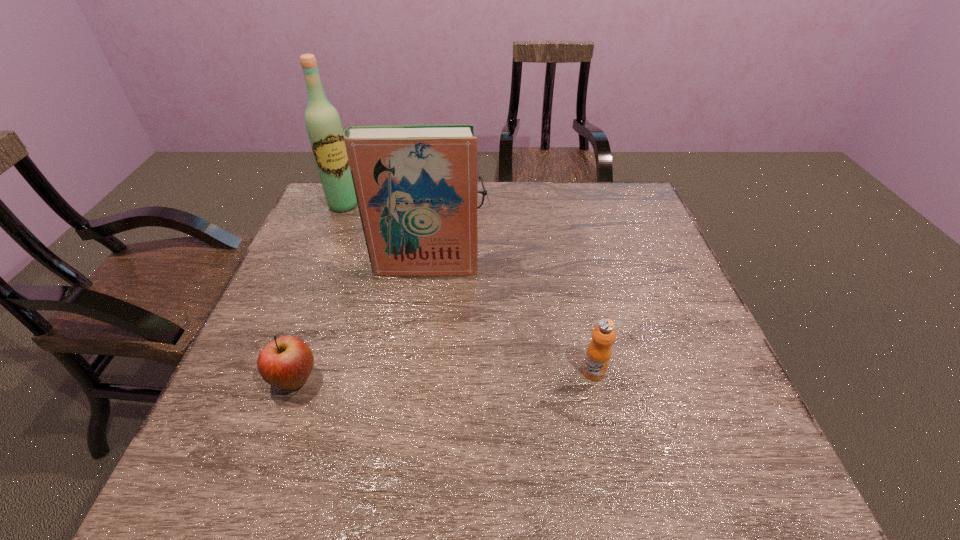
I want to click on object that is at the near edge, so click(285, 363).

Locate an element on the screen. apple at the left edge is located at coordinates (285, 363).

Identify the location of wine bottle situated at the left edge. (323, 124).

The height and width of the screenshot is (540, 960). I want to click on object at the far left corner, so click(323, 124).

This screenshot has width=960, height=540. What are the coordinates of `object present at the near left corner` in the screenshot? It's located at (285, 363).

At what (x,y) coordinates should I click in order to perform the action: click on free location at the far edge of the desktop. Please return your answer as a coordinate pair (x, y). This screenshot has width=960, height=540. Looking at the image, I should click on (553, 208).

At what (x,y) coordinates should I click in order to perform the action: click on blank space at the near edge of the desktop. Please return your answer as a coordinate pair (x, y). Looking at the image, I should click on (625, 413).

I want to click on vacant space at the left edge, so click(319, 280).

You are a GUI agent. You are given a task and a screenshot of the screen. Output one action in this format:
    pyautogui.click(x=<x>, y=<y>)
    Task: Click on the blank area at the right edge
    
    Given the screenshot: What is the action you would take?
    pyautogui.click(x=628, y=244)

In the image, there is a desktop. Where is `vacant space at the near left corner`? vacant space at the near left corner is located at coordinates (226, 402).